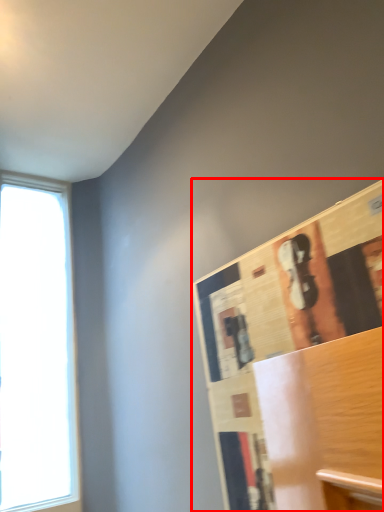
Question: Where is bulletin board (annotated by the red box) located in relation to window in the image?

Choices:
 (A) right
 (B) left

Answer: (A)